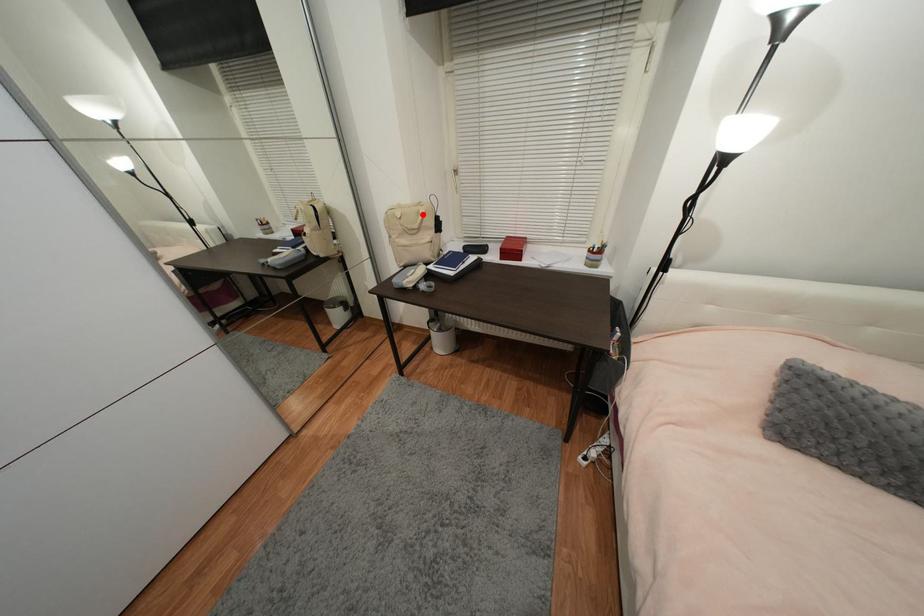
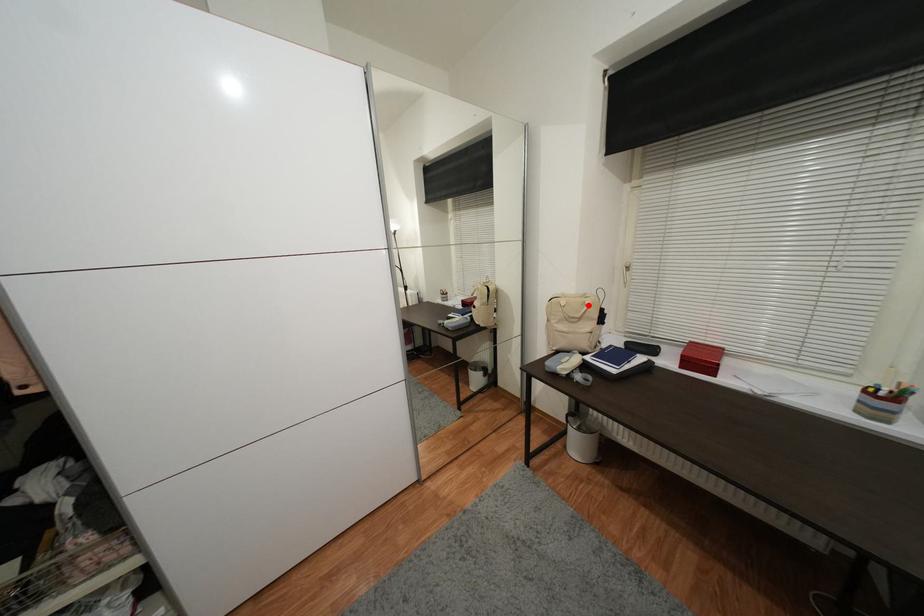
I am providing you with two images of the same scene from different viewpoints. A red point is marked on the first image and another point is marked on the second image. Are the points marked in image1 and image2 representing the same 3D position?

Yes